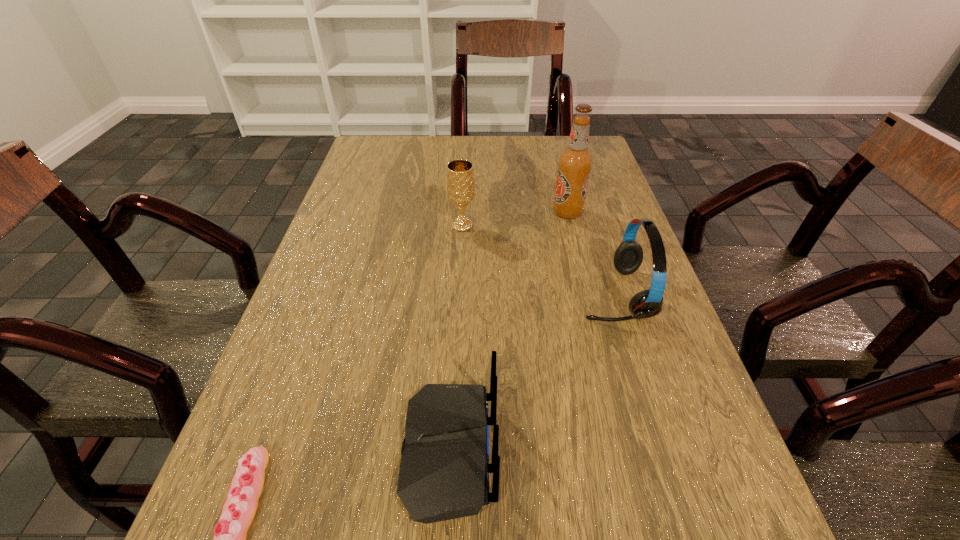
I want to click on free point located 0.240m on the right of the chalice, so (x=573, y=226).

Where is `vacant area situated on the back of the second shortest object`? vacant area situated on the back of the second shortest object is located at coordinates (642, 451).

I want to click on beer bottle positioned at the right edge, so click(x=574, y=165).

Where is `headset that is at the right edge`? This screenshot has width=960, height=540. headset that is at the right edge is located at coordinates (628, 257).

I want to click on vacant area at the far edge, so click(x=468, y=150).

The height and width of the screenshot is (540, 960). In the image, there is a desktop. Find the location of `vacant space at the left edge`. vacant space at the left edge is located at coordinates (269, 528).

Locate an element on the screen. free location at the right edge of the desktop is located at coordinates (652, 391).

Locate an element on the screen. The image size is (960, 540). free location at the far right corner is located at coordinates pyautogui.click(x=590, y=151).

This screenshot has width=960, height=540. Identify the location of empty space between the fourth tallest object and the chalice. (456, 339).

You are a GUI agent. You are given a task and a screenshot of the screen. Output one action in this format:
    pyautogui.click(x=<x>, y=<y>)
    Task: Click on the free space between the tallest object and the chalice
    The height and width of the screenshot is (540, 960).
    Given the screenshot: What is the action you would take?
    (515, 219)